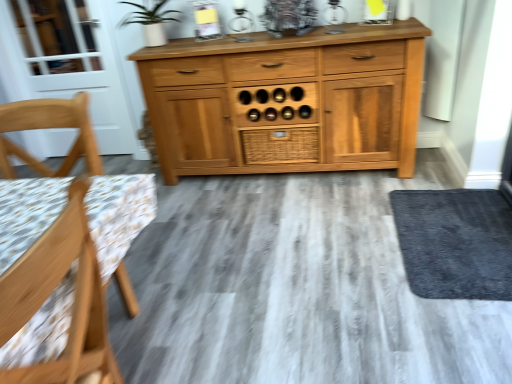
Question: Is light wood chair at left, which ranks as the 1th chair in back-to-front order, in front of or behind white glass screen door at left in the image?

Choices:
 (A) behind
 (B) front

Answer: (B)

Question: From the image's perspective, is light wood chair at left, which is the second chair from front to back, positioned above or below white glass screen door at left?

Choices:
 (A) above
 (B) below

Answer: (B)

Question: Which is farther from the dark gray carpet at lower right?

Choices:
 (A) woven wood drawer at center
 (B) wooden chair at left, which appears as the first chair when viewed from the front
 (C) white glass screen door at left
 (D) light wood chair at left, which ranks as the 1th chair in back-to-front order

Answer: (C)

Question: Which object is the farthest from the woven wood drawer at center?

Choices:
 (A) white glass screen door at left
 (B) dark gray carpet at lower right
 (C) wooden chair at left, which is counted as the 2th chair, starting from the back
 (D) light wood chair at left, which ranks as the 1th chair in back-to-front order

Answer: (C)